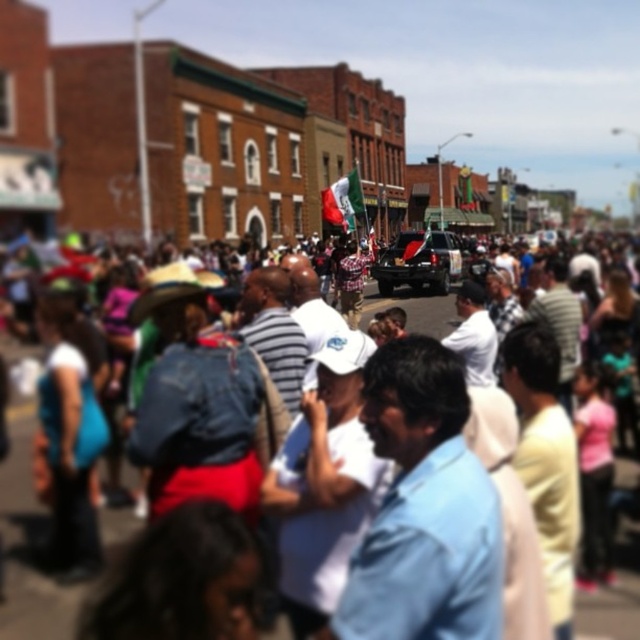
Is point (17, 515) closer to viewer compared to point (440, 272)?

Yes, point (17, 515) is closer to viewer.

Can you confirm if red flag at center is positioned to the left of shiny black suv at center?

Indeed, red flag at center is positioned on the left side of shiny black suv at center.

Identify the location of red flag at center. (28, 541).

The height and width of the screenshot is (640, 640). What are the coordinates of `red flag at center` in the screenshot? It's located at (28, 541).